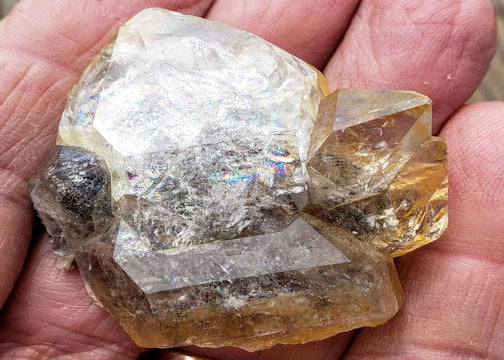
The image size is (504, 360). I want to click on surface, so click(195, 41).